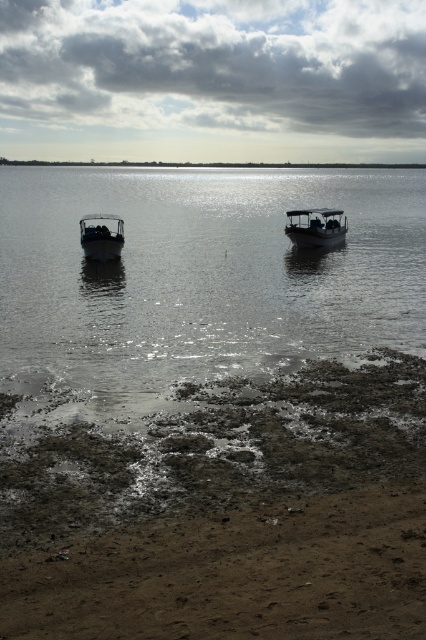
Based on the photo, who is positioned more to the left, cloudy sky at upper center or matte black boat at center?

Positioned to the left is cloudy sky at upper center.

Who is lower down, cloudy sky at upper center or matte black boat at center?

matte black boat at center is below.

Between point (189, 80) and point (108, 228), which one is positioned behind?

The point (189, 80) is behind.

Locate an element on the screen. cloudy sky at upper center is located at coordinates tap(218, 64).

Which is above, dull brown sand at lower right or glistening metallic water at center?

glistening metallic water at center

Is point (359, 564) behind point (161, 250)?

No.

Identify the location of dull brown sand at lower right. The height and width of the screenshot is (640, 426). (229, 515).

Does metallic gray boat at center appear over dark gray metallic boat at left?

Yes.

From the picture: Between metallic gray boat at center and dark gray metallic boat at left, which one has more height?

dark gray metallic boat at left

Who is more distant from viewer, (308,234) or (109,248)?

Point (308,234)

Identify the location of metallic gray boat at center. (316, 227).